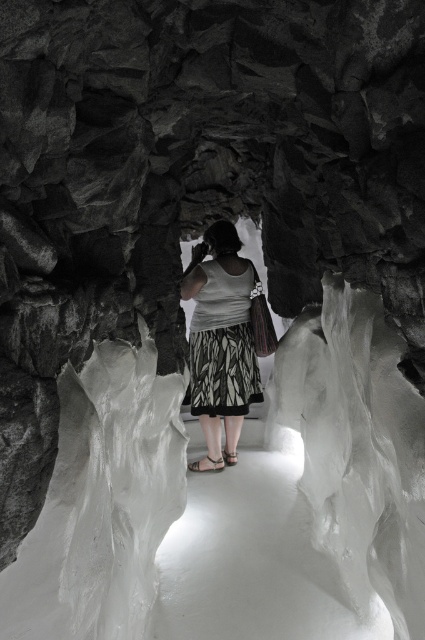
Question: Which object is farther from the camera taking this photo?

Choices:
 (A) printed fabric dress at center
 (B) white fabric sandal at center
 (C) brown leather sandal at center

Answer: (C)

Question: Which point is closer to the camera?

Choices:
 (A) printed fabric dress at center
 (B) brown leather sandal at center

Answer: (A)

Question: Does printed fabric dress at center have a greater width compared to brown leather sandal at center?

Choices:
 (A) yes
 (B) no

Answer: (A)

Question: From the image, what is the correct spatial relationship of printed fabric dress at center in relation to white fabric sandal at center?

Choices:
 (A) below
 (B) above

Answer: (B)

Question: Does white fabric sandal at center appear on the right side of brown leather sandal at center?

Choices:
 (A) yes
 (B) no

Answer: (B)

Question: Which of these objects is positioned farthest from the printed fabric dress at center?

Choices:
 (A) brown leather sandal at center
 (B) white fabric sandal at center

Answer: (A)